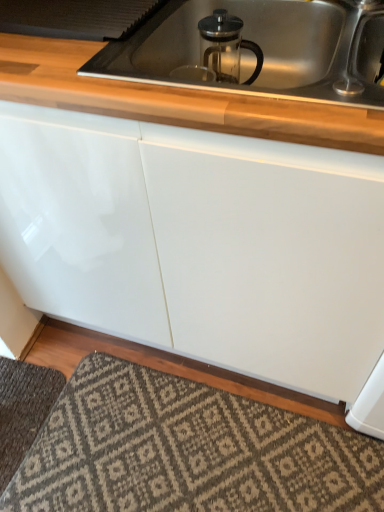
Question: From a real-world perspective, is satin nickel faucet at upper right on dark gray textured rug at lower left, the 2th doormat from the right?

Choices:
 (A) no
 (B) yes

Answer: (B)

Question: Does satin nickel faucet at upper right have a lesser height compared to dark gray textured rug at lower left, the 2th doormat from the right?

Choices:
 (A) yes
 (B) no

Answer: (B)

Question: Is satin nickel faucet at upper right at the right side of dark gray textured rug at lower left, the 2th doormat from the right?

Choices:
 (A) no
 (B) yes

Answer: (B)

Question: Would you say satin nickel faucet at upper right contains dark gray textured rug at lower left, the 2th doormat from the right?

Choices:
 (A) no
 (B) yes

Answer: (A)

Question: Is satin nickel faucet at upper right positioned in front of dark gray textured rug at lower left, the 2th doormat from the right?

Choices:
 (A) no
 (B) yes

Answer: (B)

Question: Looking at the image, does clear glass french press at upper center seem bigger or smaller compared to patterned carpet at lower center, placed as the 1th doormat when sorted from right to left?

Choices:
 (A) big
 (B) small

Answer: (B)

Question: From their relative heights in the image, would you say clear glass french press at upper center is taller or shorter than patterned carpet at lower center, which appears as the 2th doormat when viewed from the left?

Choices:
 (A) short
 (B) tall

Answer: (B)

Question: In terms of width, does clear glass french press at upper center look wider or thinner when compared to patterned carpet at lower center, which appears as the 2th doormat when viewed from the left?

Choices:
 (A) wide
 (B) thin

Answer: (B)

Question: Is clear glass french press at upper center inside or outside of patterned carpet at lower center, which appears as the 2th doormat when viewed from the left?

Choices:
 (A) outside
 (B) inside

Answer: (A)

Question: From the image's perspective, is clear glass french press at upper center above or below satin nickel faucet at upper right?

Choices:
 (A) below
 (B) above

Answer: (B)

Question: From their relative heights in the image, would you say clear glass french press at upper center is taller or shorter than satin nickel faucet at upper right?

Choices:
 (A) short
 (B) tall

Answer: (B)

Question: Is clear glass french press at upper center spatially inside satin nickel faucet at upper right, or outside of it?

Choices:
 (A) inside
 (B) outside

Answer: (B)

Question: Is clear glass french press at upper center to the left or to the right of satin nickel faucet at upper right in the image?

Choices:
 (A) right
 (B) left

Answer: (B)

Question: From the image's perspective, is clear glass french press at upper center positioned above or below dark gray textured rug at lower left, which appears as the 1th doormat when viewed from the left?

Choices:
 (A) above
 (B) below

Answer: (A)

Question: From a real-world perspective, is clear glass french press at upper center positioned above or below dark gray textured rug at lower left, which appears as the 1th doormat when viewed from the left?

Choices:
 (A) below
 (B) above

Answer: (B)